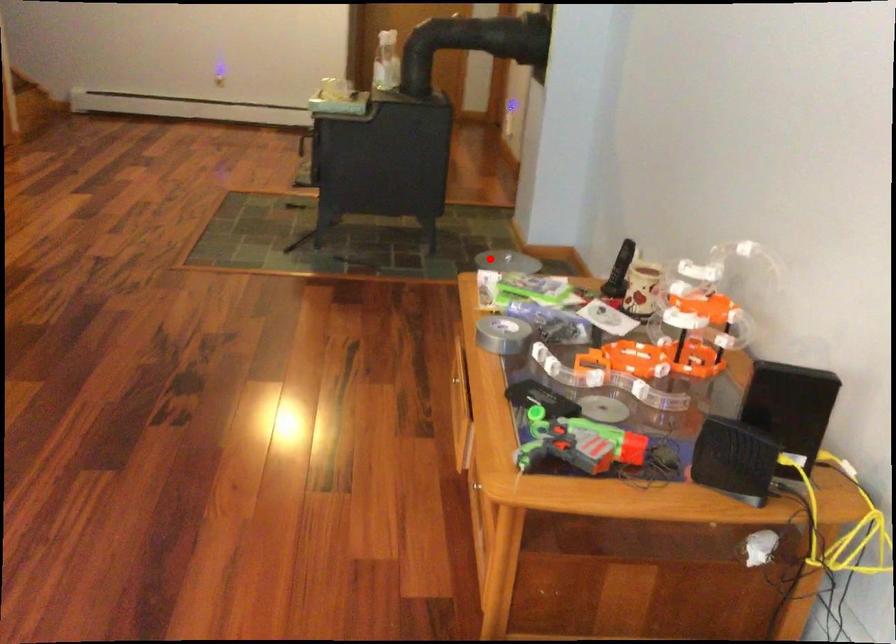
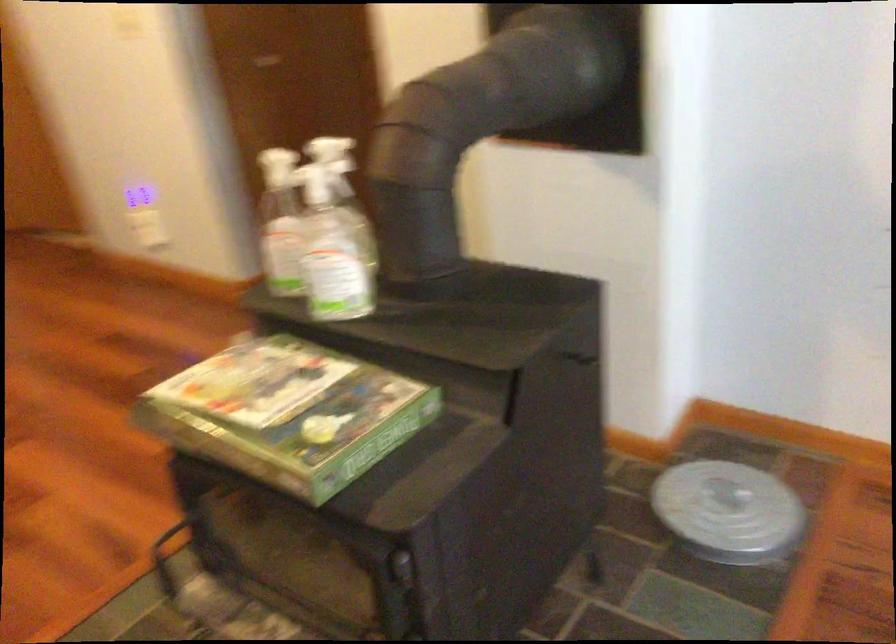
Where in the second image is the point corresponding to the highlighted location from the first image?

(728, 512)